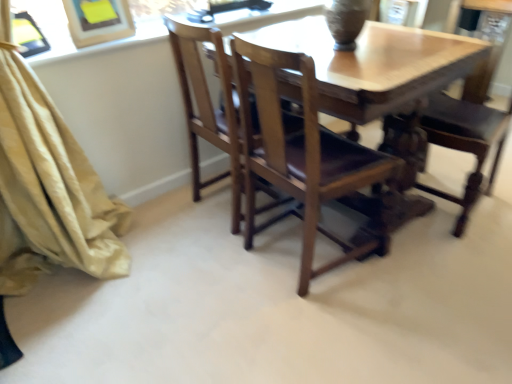
Find the location of a particular element. free space on the front side of wooden chair at center, the 1th chair from the right is located at coordinates (457, 251).